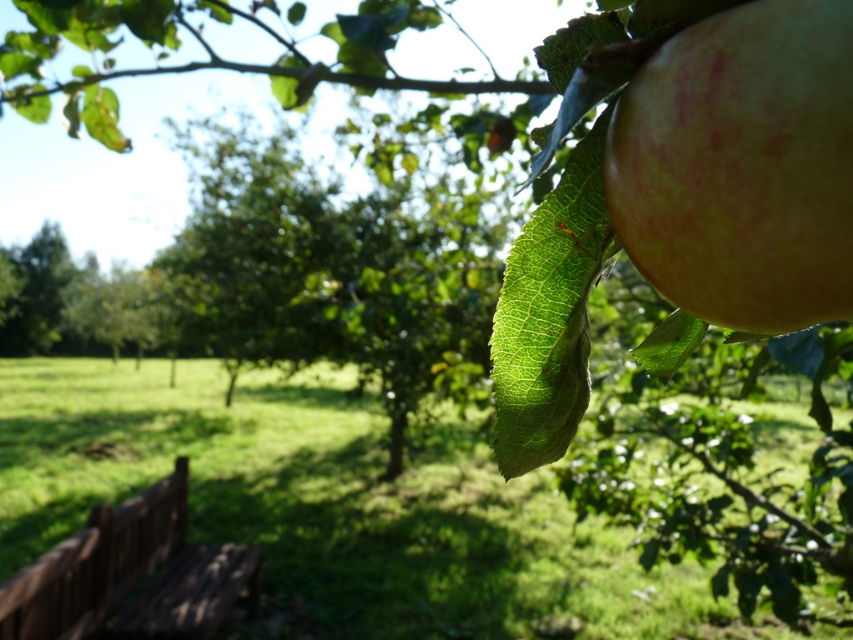
Is ripe yellow-green apple at upper right shorter than brown wooden bench at lower left?

Yes.

Consider the image. Does ripe yellow-green apple at upper right lie in front of brown wooden bench at lower left?

Yes, ripe yellow-green apple at upper right is in front of brown wooden bench at lower left.

Does point (769, 131) come in front of point (172, 572)?

That is True.

The width and height of the screenshot is (853, 640). In order to click on ripe yellow-green apple at upper right in this screenshot , I will do pyautogui.click(x=741, y=166).